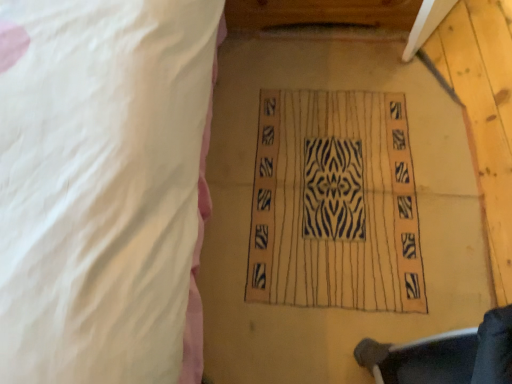
Question: Should I look upward or downward to see zebra-patterned fabric at center?

Choices:
 (A) down
 (B) up

Answer: (B)